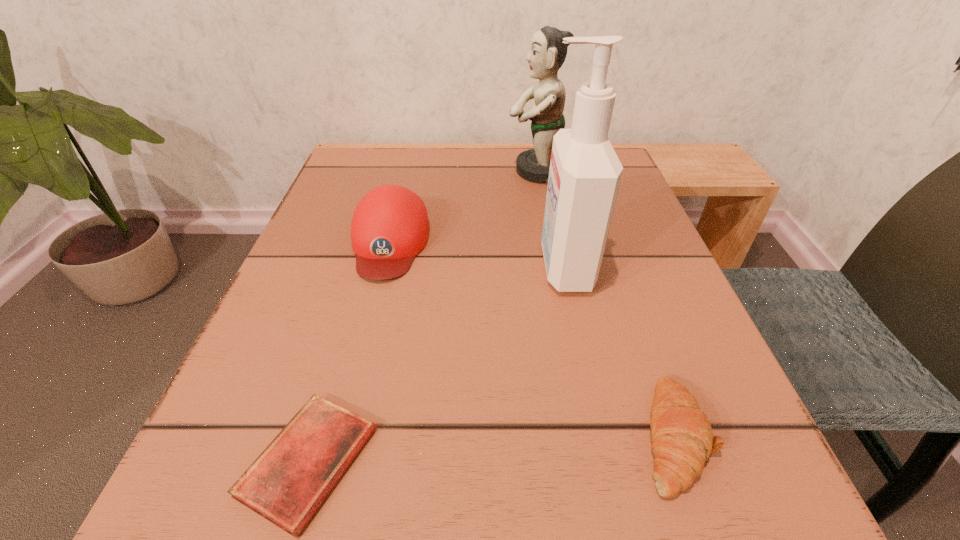
Find the location of `the tallest object`. the tallest object is located at coordinates pos(584,177).

Locate an element on the screen. the farthest object is located at coordinates (547, 54).

Locate an element on the screen. the fourth shortest object is located at coordinates (547, 54).

At what (x,y) coordinates should I click in order to perform the action: click on the third shortest object. Please return your answer as a coordinate pair (x, y). Looking at the image, I should click on (390, 226).

Find the location of a particular element. Image resolution: width=960 pixels, height=540 pixels. the fourth tallest object is located at coordinates (682, 438).

The height and width of the screenshot is (540, 960). I want to click on diary, so click(287, 483).

Where is `vacant space situated 0.220m on the front label of the cleansing agent`? This screenshot has width=960, height=540. vacant space situated 0.220m on the front label of the cleansing agent is located at coordinates (405, 267).

Image resolution: width=960 pixels, height=540 pixels. Identify the location of free space located on the front label of the cleansing agent. (315, 267).

Identify the location of vacant area situated on the front label of the cleansing agent. Image resolution: width=960 pixels, height=540 pixels. (418, 267).

The height and width of the screenshot is (540, 960). In order to click on vacant space located 0.350m on the front-facing side of the farthest object in this screenshot , I will do `click(348, 171)`.